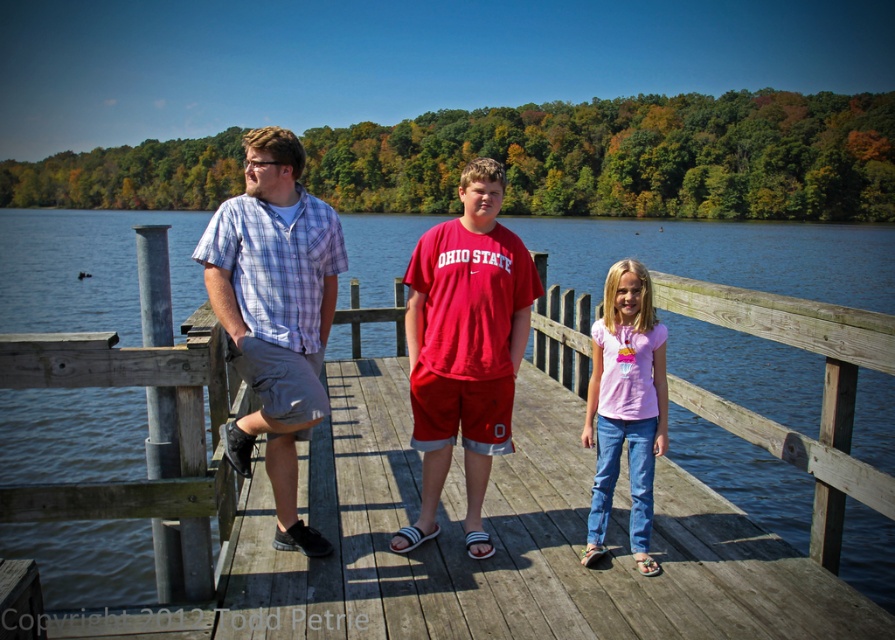
Is transparent water at dock center taller than pink cotton shirt at center?

Yes.

Between transparent water at dock center and pink cotton shirt at center, which one is positioned higher?

transparent water at dock center

Where is `transparent water at dock center`? transparent water at dock center is located at coordinates (723, 253).

Does point (266, 253) come behind point (655, 404)?

No, (266, 253) is in front of (655, 404).

In the scene shown: Between plaid cotton shirt at center and pink cotton shirt at center, which one has more height?

Standing taller between the two is pink cotton shirt at center.

Which is in front, point (243, 440) or point (631, 480)?

Point (243, 440) is in front.

Locate an element on the screen. The image size is (895, 640). plaid cotton shirt at center is located at coordinates (275, 312).

Can you confirm if red matte t-shirt at center is positioned to the left of pink cotton shirt at center?

Yes, red matte t-shirt at center is to the left of pink cotton shirt at center.

Between red matte t-shirt at center and pink cotton shirt at center, which one appears on the right side from the viewer's perspective?

pink cotton shirt at center

Find the location of `red matte t-shirt at center`. red matte t-shirt at center is located at coordinates (465, 348).

The width and height of the screenshot is (895, 640). Identify the location of red matte t-shirt at center. (465, 348).